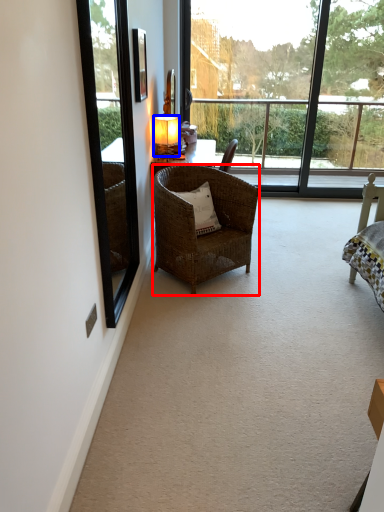
Question: Among these objects, which one is nearest to the camera, chair (highlighted by a red box) or lamp (highlighted by a blue box)?

Choices:
 (A) chair
 (B) lamp

Answer: (A)